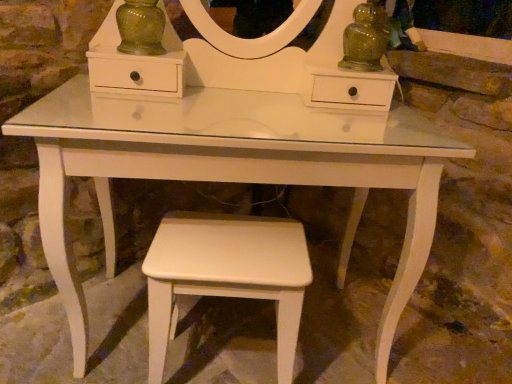
The width and height of the screenshot is (512, 384). Find the location of `vacant space situated above white matte stool at lower center (from a real-world perspective)`. vacant space situated above white matte stool at lower center (from a real-world perspective) is located at coordinates (233, 247).